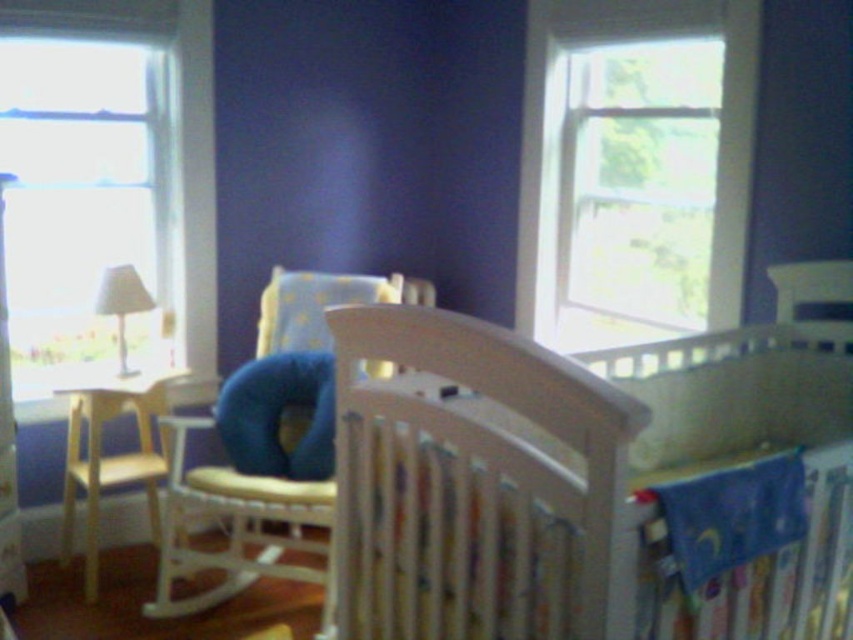
Question: Which object appears closest to the camera in this image?

Choices:
 (A) white wood rocking chair at upper right
 (B) light beige wood rocking chair at center

Answer: (A)

Question: Based on their relative distances, which object is nearer to the light beige wood rocking chair at center?

Choices:
 (A) transparent glass window at left
 (B) light wood changing table at left

Answer: (B)

Question: Does transparent glass window at upper right have a greater width compared to light wood changing table at left?

Choices:
 (A) yes
 (B) no

Answer: (A)

Question: Which object appears closest to the camera in this image?

Choices:
 (A) transparent glass window at upper right
 (B) white wooden crib at center
 (C) light wood changing table at left
 (D) light beige wood rocking chair at center

Answer: (B)

Question: Is light beige wood rocking chair at center further to camera compared to light wood changing table at left?

Choices:
 (A) yes
 (B) no

Answer: (B)

Question: Does light beige wood rocking chair at center have a larger size compared to white wood rocking chair at upper right?

Choices:
 (A) no
 (B) yes

Answer: (B)